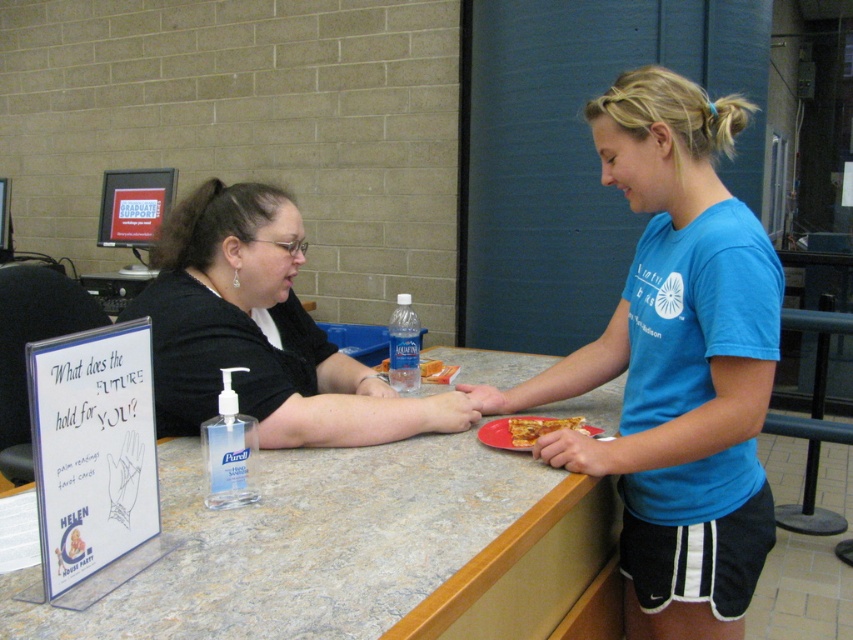
Is marble countertop at center above blue cotton shirt at center?

Incorrect, marble countertop at center is not positioned above blue cotton shirt at center.

Does marble countertop at center appear on the right side of blue cotton shirt at center?

Incorrect, marble countertop at center is not on the right side of blue cotton shirt at center.

What do you see at coordinates (358, 548) in the screenshot? The width and height of the screenshot is (853, 640). I see `marble countertop at center` at bounding box center [358, 548].

At what (x,y) coordinates should I click in order to perform the action: click on marble countertop at center. Please return your answer as a coordinate pair (x, y). Looking at the image, I should click on (358, 548).

Can you confirm if blue cotton shirt at center is bigger than golden crispy pizza slice at center?

Yes, blue cotton shirt at center is bigger than golden crispy pizza slice at center.

How distant is blue cotton shirt at center from golden crispy pizza slice at center?

They are 10.68 inches apart.

Who is more distant from viewer, [740,260] or [521,433]?

The point [521,433] is more distant.

Find the location of a particular element. Image resolution: width=853 pixels, height=640 pixels. blue cotton shirt at center is located at coordinates [676, 364].

Does point (85, 616) come closer to viewer compared to point (303, 420)?

Yes, it is.

Which is in front, point (225, 536) or point (242, 204)?

Point (225, 536) is in front.

Is point (471, 518) positioned in front of point (259, 320)?

Yes, point (471, 518) is closer to viewer.

Find the location of a particular element. The image size is (853, 640). marble countertop at center is located at coordinates (358, 548).